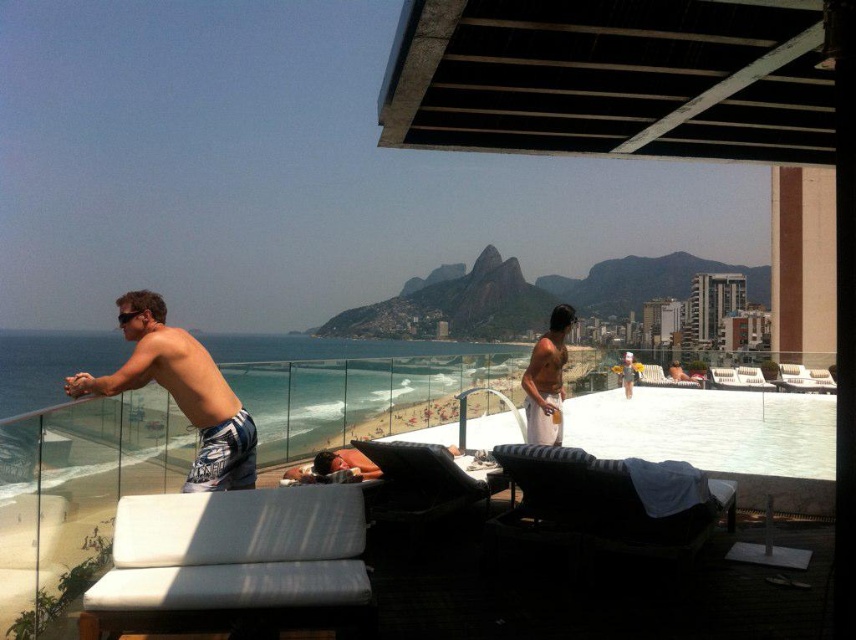
Question: Observing the image, what is the correct spatial positioning of white textured shorts at left in reference to white cotton shorts at center?

Choices:
 (A) left
 (B) right

Answer: (A)

Question: Does black striped daybed at lower right appear under white cotton shorts at center?

Choices:
 (A) no
 (B) yes

Answer: (B)

Question: Which of the following is the farthest from the observer?

Choices:
 (A) (117, 371)
 (B) (530, 481)

Answer: (A)

Question: Among these objects, which one is farthest from the camera?

Choices:
 (A) white textured shorts at left
 (B) white cotton shorts at center

Answer: (B)

Question: Considering the relative positions of black striped daybed at lower right and white cotton shorts at center in the image provided, where is black striped daybed at lower right located with respect to white cotton shorts at center?

Choices:
 (A) above
 (B) below

Answer: (B)

Question: Which is farther from the white textured shorts at left?

Choices:
 (A) black striped daybed at lower right
 (B) white cotton shorts at center

Answer: (B)